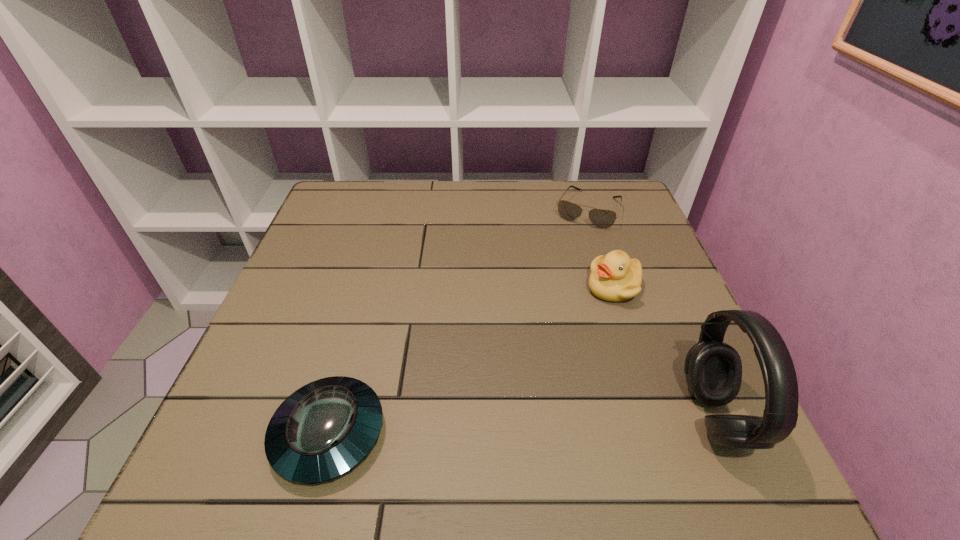
Identify the location of free spot on the desktop that is between the leftmost object and the tallest object and is positioned on the beak of the third nearest object. (530, 424).

Where is `free space on the desktop that is between the leftmost object and the headset and is positioned on the front-facing side of the farthest object`? This screenshot has width=960, height=540. free space on the desktop that is between the leftmost object and the headset and is positioned on the front-facing side of the farthest object is located at coordinates (488, 426).